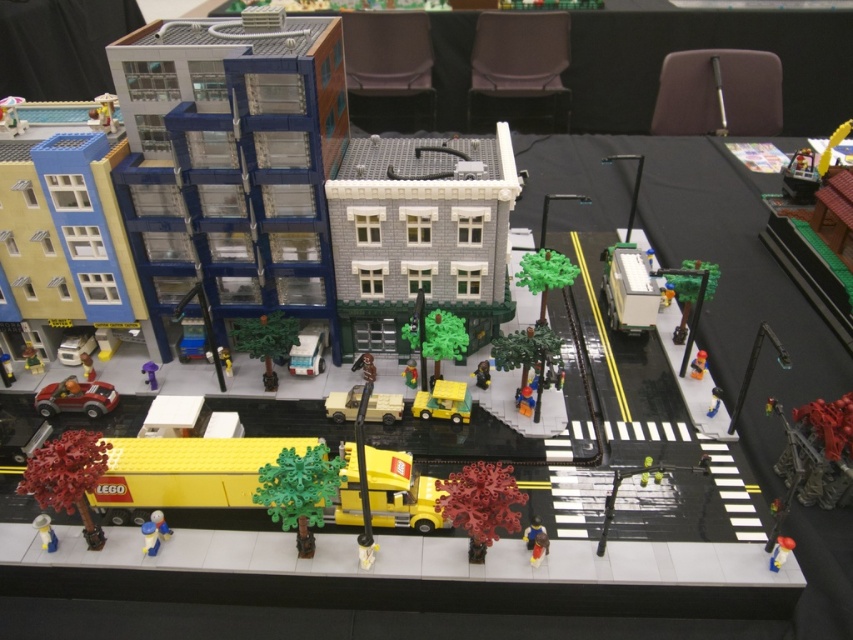
You are a tiny LEGO figure standing on the table where the LEGO city is built. You want to reach the yellow matte car at center from the green matte tree at center. Which direction should you move to get there?

The green matte tree at center is located below the yellow matte car at center, so you should move upward to reach the yellow matte car at center from the green matte tree at center.

You are a bird flying over the LEGO cityscape. You want to land precisely on the green matte tree at center. What are the coordinates where you should aim?

The green matte tree at center is located at coordinates point (299, 492), so you should aim for that point to land precisely on it.

You are holding a camera and want to take a photo of the green matte tree at center. If you are standing 3.29 meters away from the tree, is that a suitable distance for a full view of the tree in your photo?

The green matte tree at center and camera are 3.29 meters apart from each other. This distance should be suitable for capturing a full view of the tree in the photo, assuming the camera has an appropriate lens or zoom setting.